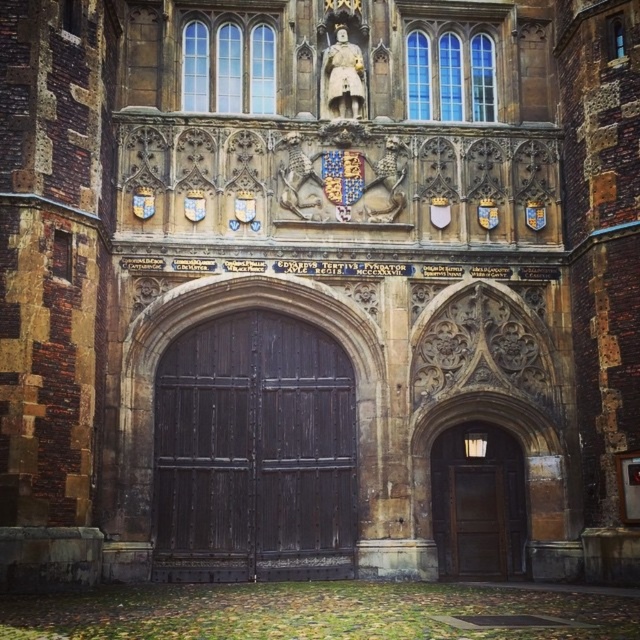
Which is more to the right, brown wooden door at center or brown wooden door at lower right?

brown wooden door at lower right

Describe the element at coordinates (477, 504) in the screenshot. I see `brown wooden door at center` at that location.

Between point (506, 540) and point (484, 529), which one is positioned in front?

Point (506, 540) is more forward.

Where is `brown wooden door at center`? This screenshot has width=640, height=640. brown wooden door at center is located at coordinates (477, 504).

Describe the element at coordinates (253, 452) in the screenshot. I see `dark wood door at center` at that location.

Is point (186, 488) more distant than point (516, 548)?

No.

Is point (298, 348) closer to camera compared to point (480, 506)?

No, (298, 348) is behind (480, 506).

This screenshot has width=640, height=640. In order to click on dark wood door at center in this screenshot , I will do `click(253, 452)`.

Does dark wood door at center have a lesser width compared to brown wooden door at lower right?

In fact, dark wood door at center might be wider than brown wooden door at lower right.

Which is more to the right, dark wood door at center or brown wooden door at lower right?

brown wooden door at lower right

Locate an element on the screen. dark wood door at center is located at coordinates (253, 452).